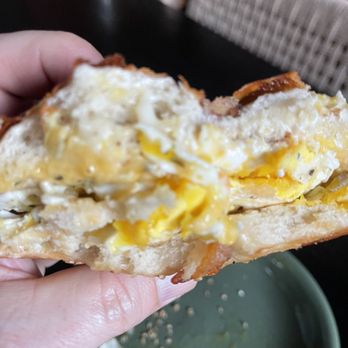
Where is `plate`? plate is located at coordinates (274, 314).